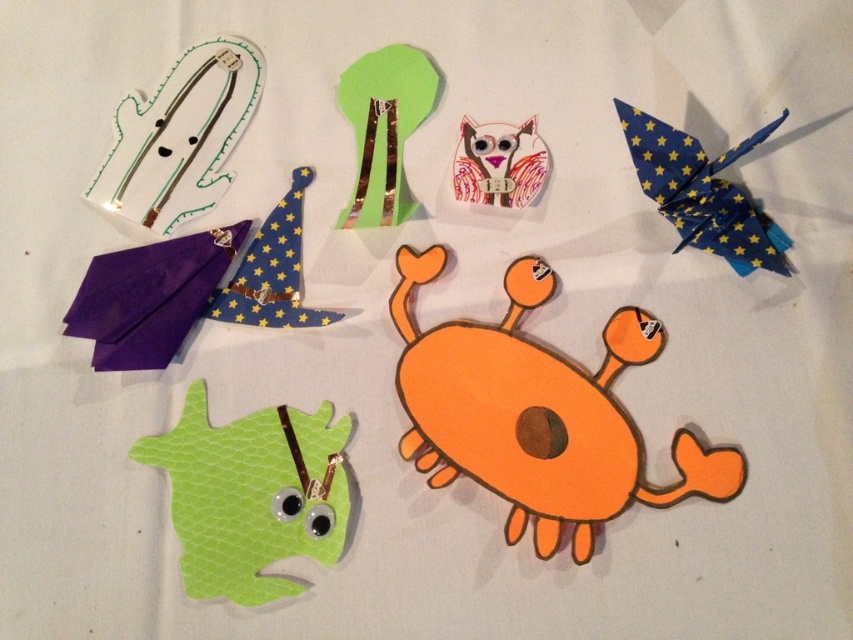
Question: Is orange cardboard alien at center positioned in front of blue star-patterned origami bird at upper right?

Choices:
 (A) no
 (B) yes

Answer: (B)

Question: Which of these objects is positioned closest to the orange cardboard alien at center?

Choices:
 (A) white paper ghost at upper left
 (B) green textured monster at lower left

Answer: (B)

Question: Is blue star-patterned origami bird at upper right thinner than metallic silver owl at center?

Choices:
 (A) yes
 (B) no

Answer: (B)

Question: Which object appears closest to the camera in this image?

Choices:
 (A) green paper tree at upper center
 (B) white paper ghost at upper left
 (C) metallic silver owl at center
 (D) green textured monster at lower left

Answer: (D)

Question: Which of the following is the closest to the observer?

Choices:
 (A) (167, 134)
 (B) (711, 164)
 (C) (354, 77)

Answer: (B)

Question: Does green paper tree at upper center have a lesser width compared to metallic silver owl at center?

Choices:
 (A) yes
 (B) no

Answer: (B)